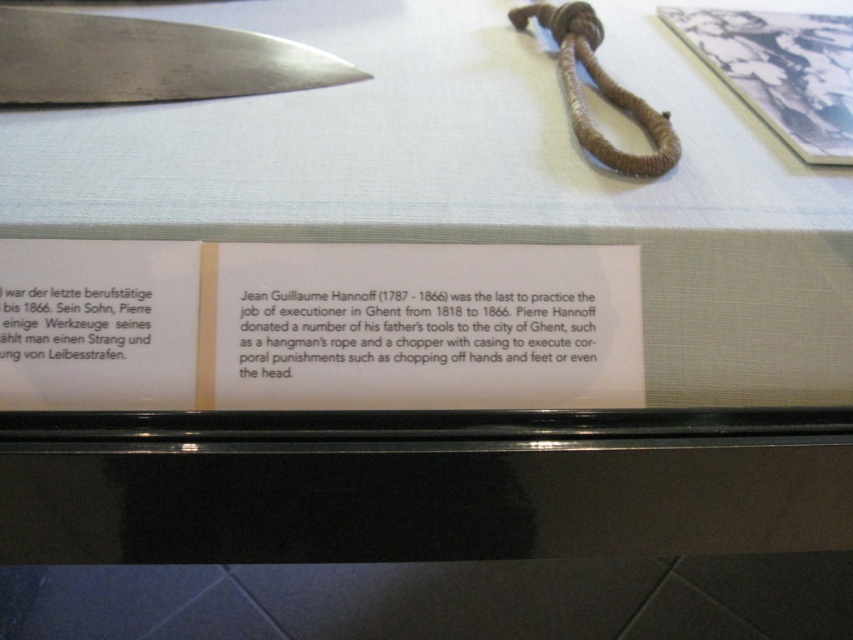
Question: Can you confirm if black paper at lower left is smaller than brown woven rope at upper center?

Choices:
 (A) yes
 (B) no

Answer: (A)

Question: Which of the following is the farthest from the observer?

Choices:
 (A) polished metal knife at upper left
 (B) brown woven rope at upper center
 (C) black paper at lower left
 (D) black paper at center

Answer: (A)

Question: Which of the following is the farthest from the observer?

Choices:
 (A) (647, 106)
 (B) (432, 321)
 (C) (45, 84)

Answer: (C)

Question: Is the position of black paper at center more distant than that of polished metal knife at upper left?

Choices:
 (A) no
 (B) yes

Answer: (A)

Question: Where is polished metal knife at upper left located in relation to brown woven rope at upper center in the image?

Choices:
 (A) above
 (B) below

Answer: (A)

Question: Which object is positioned farthest from the black paper at center?

Choices:
 (A) polished metal knife at upper left
 (B) black paper at lower left

Answer: (A)